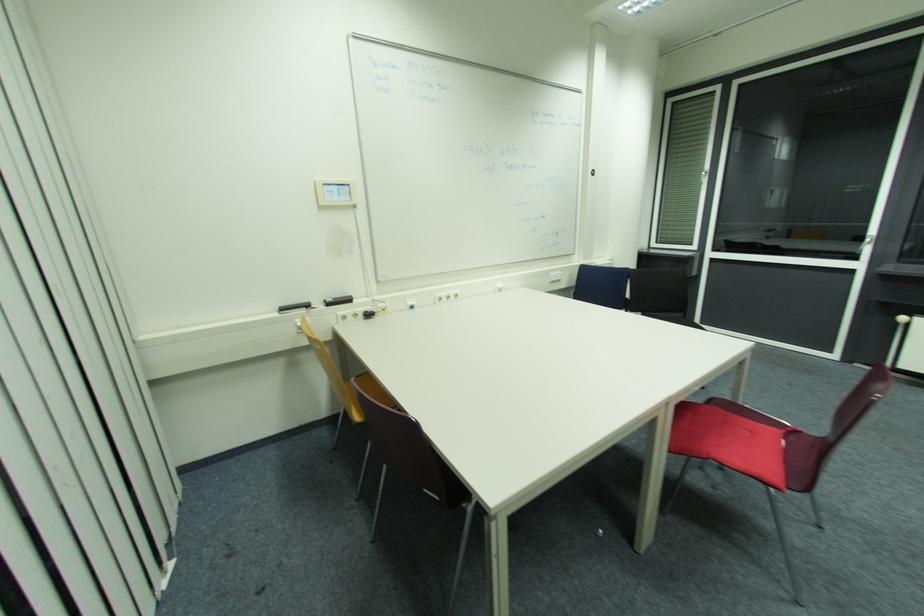
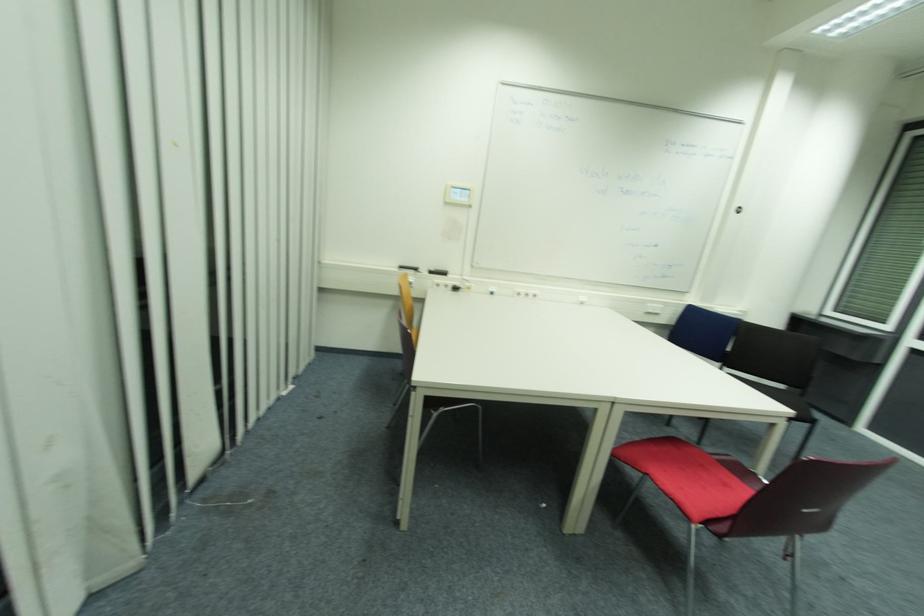
Where in the second image is the point corresponding to (311,307) from the first image?

(419, 270)